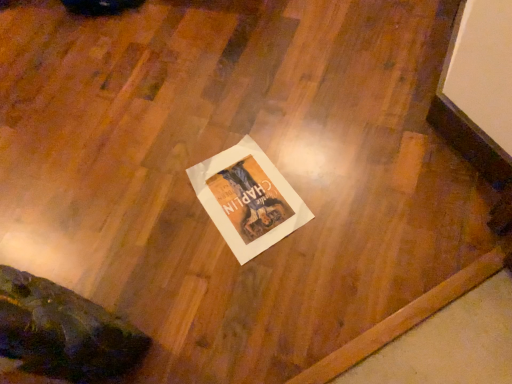
Where is `vacant area that is in front of white paper poster at center`? vacant area that is in front of white paper poster at center is located at coordinates (275, 288).